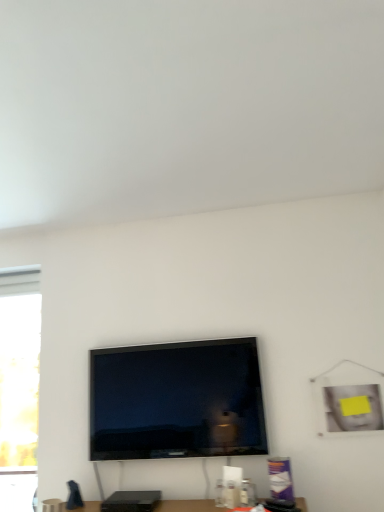
Question: Is matte black tv at center far from translucent glass window at left?

Choices:
 (A) yes
 (B) no

Answer: (B)

Question: Considering the relative sizes of matte black tv at center and translucent glass window at left in the image provided, is matte black tv at center taller than translucent glass window at left?

Choices:
 (A) no
 (B) yes

Answer: (A)

Question: Does matte black tv at center lie in front of translucent glass window at left?

Choices:
 (A) yes
 (B) no

Answer: (A)

Question: Is matte black tv at center beside translucent glass window at left?

Choices:
 (A) yes
 (B) no

Answer: (B)

Question: Is matte black tv at center looking in the opposite direction of translucent glass window at left?

Choices:
 (A) yes
 (B) no

Answer: (B)

Question: From the image's perspective, is matte black tv at center above translucent glass window at left?

Choices:
 (A) yes
 (B) no

Answer: (A)

Question: Does translucent glass window at left appear on the left side of matte black tv at center?

Choices:
 (A) no
 (B) yes

Answer: (B)

Question: Considering the relative sizes of translucent glass window at left and matte black tv at center in the image provided, is translucent glass window at left smaller than matte black tv at center?

Choices:
 (A) no
 (B) yes

Answer: (B)

Question: Would you say translucent glass window at left is a long distance from matte black tv at center?

Choices:
 (A) no
 (B) yes

Answer: (A)

Question: Is translucent glass window at left positioned before matte black tv at center?

Choices:
 (A) yes
 (B) no

Answer: (B)

Question: Is translucent glass window at left aimed at matte black tv at center?

Choices:
 (A) yes
 (B) no

Answer: (B)

Question: From a real-world perspective, is translucent glass window at left positioned under matte black tv at center based on gravity?

Choices:
 (A) no
 (B) yes

Answer: (B)

Question: Does matte black speaker at lower center have a greater height compared to matte black tv at center?

Choices:
 (A) yes
 (B) no

Answer: (B)